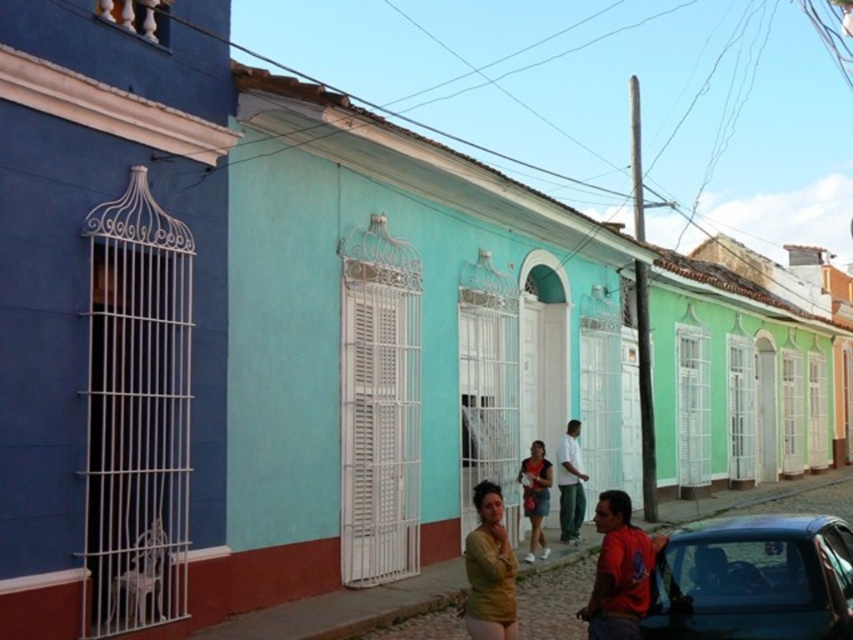
Can you confirm if shiny blue car at lower right is wider than matte yellow shirt at center?

Yes.

At what (x,y) coordinates should I click in order to perform the action: click on shiny blue car at lower right. Please return your answer as a coordinate pair (x, y). The image size is (853, 640). Looking at the image, I should click on (753, 579).

Is matte yellow shirt at center wider than white cotton shirt at center?

No, matte yellow shirt at center is not wider than white cotton shirt at center.

Which is in front, point (482, 554) or point (566, 532)?

Positioned in front is point (482, 554).

Where is `matte yellow shirt at center`? matte yellow shirt at center is located at coordinates (489, 570).

Is matte yellow shirt at center below matte black shirt at center?

Actually, matte yellow shirt at center is above matte black shirt at center.

Can you confirm if matte yellow shirt at center is bigger than matte black shirt at center?

Actually, matte yellow shirt at center might be smaller than matte black shirt at center.

Is point (500, 573) in front of point (524, 560)?

Yes, point (500, 573) is in front of point (524, 560).

Where is `matte yellow shirt at center`? The width and height of the screenshot is (853, 640). matte yellow shirt at center is located at coordinates (489, 570).